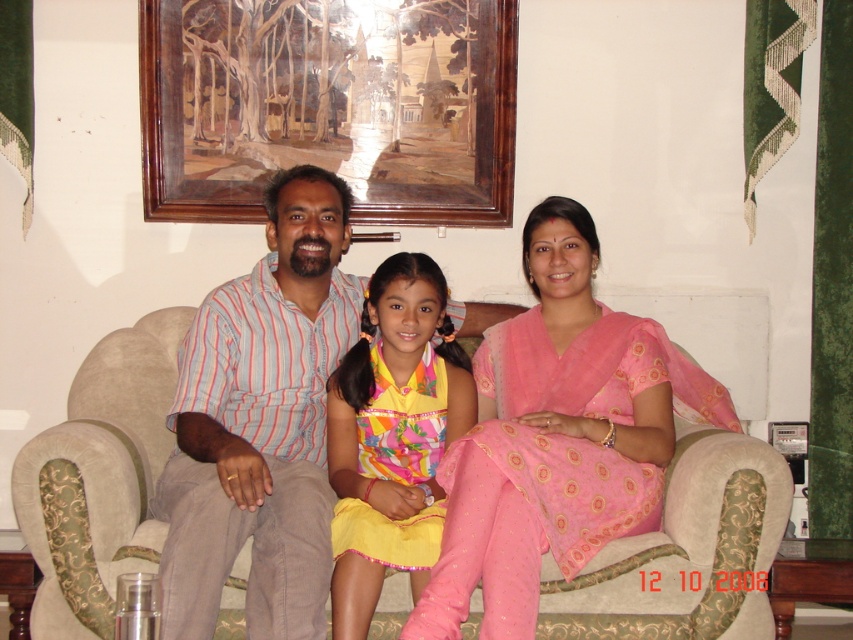
What is located at the coordinates point (260, 422) in the image?

The point (260, 422) corresponds to the striped cotton shirt at center.

You are standing in the living room and want to sit on the beige fabric couch at center. Based on the coordinates provided, can you estimate where the couch is located in the room?

The beige fabric couch at center is located at coordinates point (x=99, y=477), which means it is positioned towards the lower right of the room.